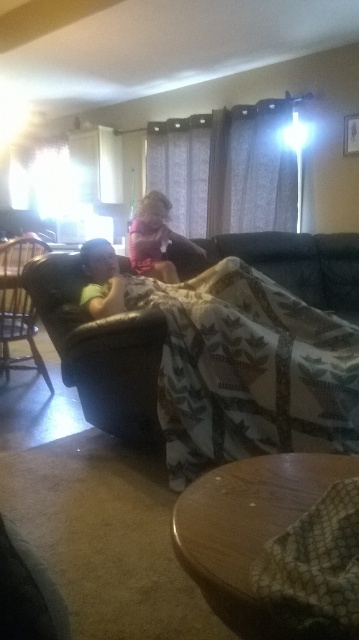
In the scene shown: You are trying to decide whether to place a new throw pillow on the brown quilted blanket at center or the dark brown leather armchair at left. Based on their sizes, which surface would allow the pillow to be more visible?

The brown quilted blanket at center has a larger size compared to the dark brown leather armchair at left, so placing the throw pillow on the brown quilted blanket at center would make it more visible.